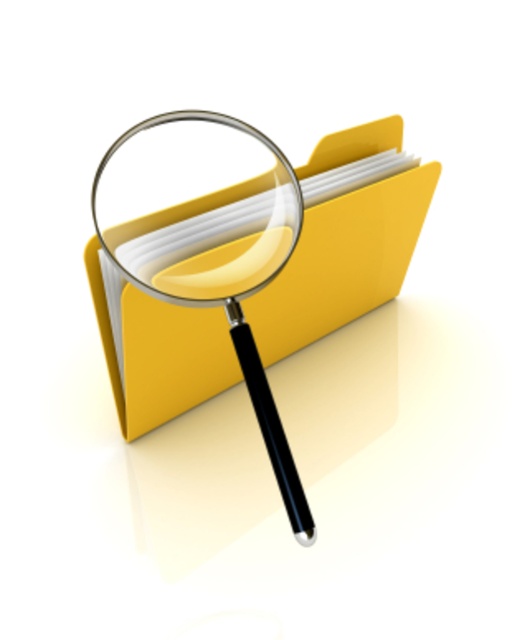
Looking at this image, you are organizing a desk and need to place both the transparent plastic magnifying glass at center and the transparent glass magnifying glass at center. Since they are both at the center, which one is easier to reach without moving the other?

The transparent plastic magnifying glass at center is closer to the viewer, so it is easier to reach without moving the other transparent glass magnifying glass at center.